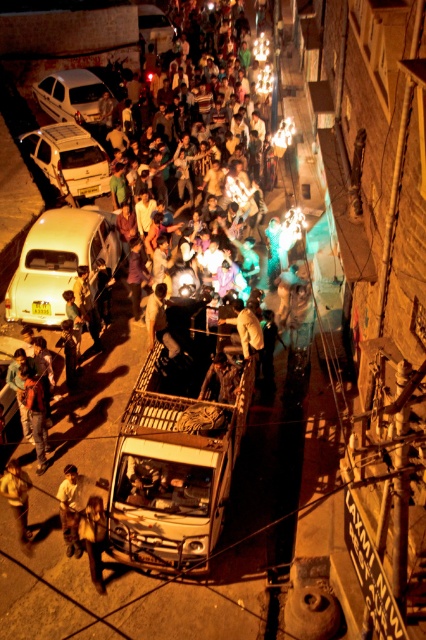
Question: Is multicolored fabric crowd at center in front of dark brown leather shoes at lower center?

Choices:
 (A) yes
 (B) no

Answer: (B)

Question: Estimate the real-world distances between objects in this image. Which object is farther from the multicolored fabric crowd at center?

Choices:
 (A) metallic silver car at upper left
 (B) light brown leather jacket at lower left

Answer: (B)

Question: From the image, what is the correct spatial relationship of multicolored fabric crowd at center in relation to dark brown leather jacket at center?

Choices:
 (A) right
 (B) left

Answer: (B)

Question: Which point is farther to the camera?

Choices:
 (A) dark brown leather jacket at center
 (B) matte white car at lower left
 (C) yellow fabric shirt at lower left
 (D) dark brown leather shoes at lower center

Answer: (B)

Question: Does yellow fabric shirt at lower left have a lesser width compared to dark brown leather jacket at center?

Choices:
 (A) yes
 (B) no

Answer: (A)

Question: Which object is positioned closest to the dark brown leather jacket at center?

Choices:
 (A) matte white sedan at upper left
 (B) dark brown leather shoes at lower center

Answer: (B)